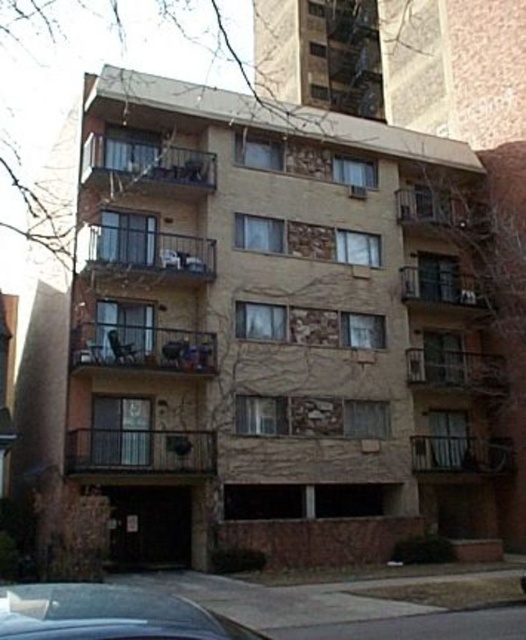
Question: Does dark brown stone balcony at center have a smaller size compared to brown stone balcony at center?

Choices:
 (A) yes
 (B) no

Answer: (B)

Question: Is wooden balcony at center above stone textured balcony at lower right?

Choices:
 (A) yes
 (B) no

Answer: (A)

Question: Which point appears farthest from the camera in this image?

Choices:
 (A) (214, 348)
 (B) (103, 250)
 (C) (524, 589)
 (D) (433, 435)

Answer: (D)

Question: Which point is farther to the camera?

Choices:
 (A) (146, 364)
 (B) (215, 157)
 (C) (53, 605)
 (D) (440, 372)

Answer: (D)

Question: Which object is the closest to the rustic stone balcony at center?

Choices:
 (A) dark brown stone balcony at center
 (B) brown stone balcony at center
 (C) black glossy car at lower left

Answer: (A)

Question: Is metallic silver balcony at center to the left of brown stone balcony at upper center from the viewer's perspective?

Choices:
 (A) yes
 (B) no

Answer: (A)